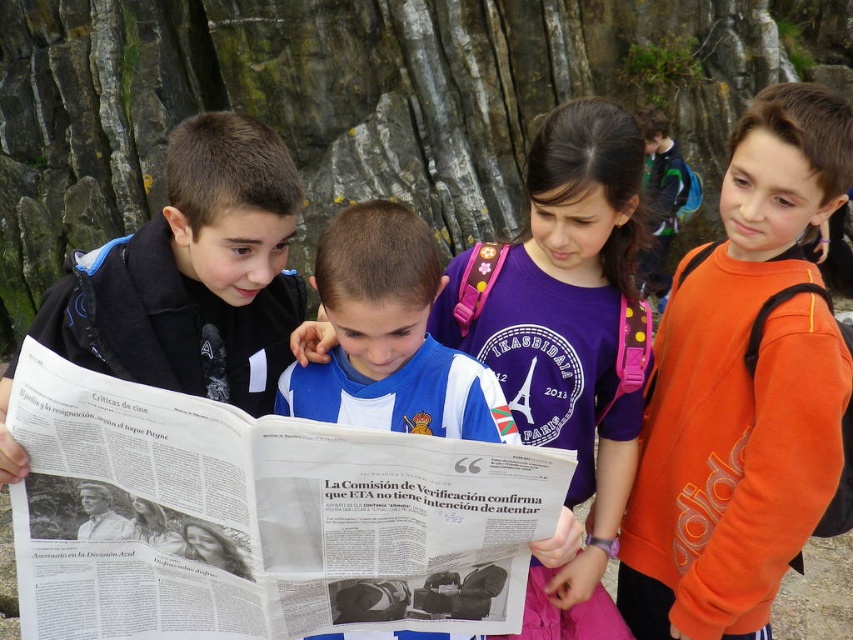
Is white paper at center taller than blue jersey at center?

Incorrect, white paper at center's height is not larger of blue jersey at center's.

Locate an element on the screen. The width and height of the screenshot is (853, 640). white paper at center is located at coordinates (258, 518).

You are a GUI agent. You are given a task and a screenshot of the screen. Output one action in this format:
    pyautogui.click(x=<x>, y=<y>)
    Task: Click on the white paper at center
    
    Given the screenshot: What is the action you would take?
    pyautogui.click(x=258, y=518)

Who is more distant from viewer, (273,563) or (717,285)?

The point (717,285) is more distant.

Which is above, white paper at center or orange fleece sweatshirt at right?

orange fleece sweatshirt at right is higher up.

The height and width of the screenshot is (640, 853). I want to click on white paper at center, so (x=258, y=518).

Who is more distant from viewer, (737, 371) or (105, 266)?

The point (737, 371) is more distant.

Measure the distance between orange fleece sweatshirt at right and matte black jacket at center.

They are 35.07 feet apart.

Between point (759, 144) and point (235, 116), which one is positioned behind?

The point (759, 144) is behind.

Where is `orange fleece sweatshirt at right`? orange fleece sweatshirt at right is located at coordinates (741, 388).